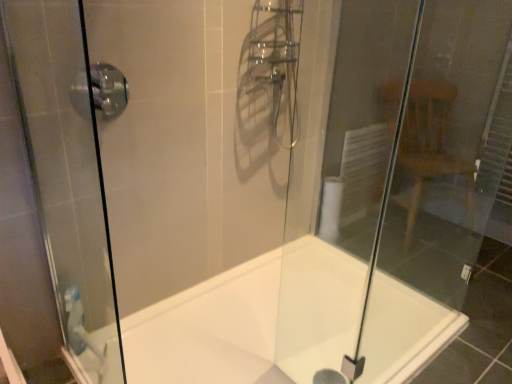
Question: Do you think transparent glass shower door at left is within transparent glass door at right, or outside of it?

Choices:
 (A) inside
 (B) outside

Answer: (B)

Question: Would you say transparent glass shower door at left is to the left or to the right of transparent glass door at right in the picture?

Choices:
 (A) right
 (B) left

Answer: (B)

Question: Estimate the real-world distances between objects in this image. Which object is closer to the transparent glass shower door at left?

Choices:
 (A) white glossy bathtub at center
 (B) satin chrome shower handle at upper left
 (C) transparent glass door at right

Answer: (B)

Question: Which is farther from the transparent glass shower door at left?

Choices:
 (A) transparent glass door at right
 (B) satin chrome shower handle at upper left
 (C) white glossy bathtub at center

Answer: (A)